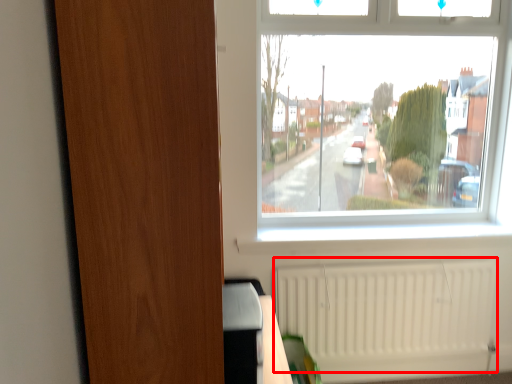
Question: From the image's perspective, considering the relative positions of radiator (annotated by the red box) and screen door in the image provided, where is radiator (annotated by the red box) located with respect to the staircase?

Choices:
 (A) below
 (B) above

Answer: (A)